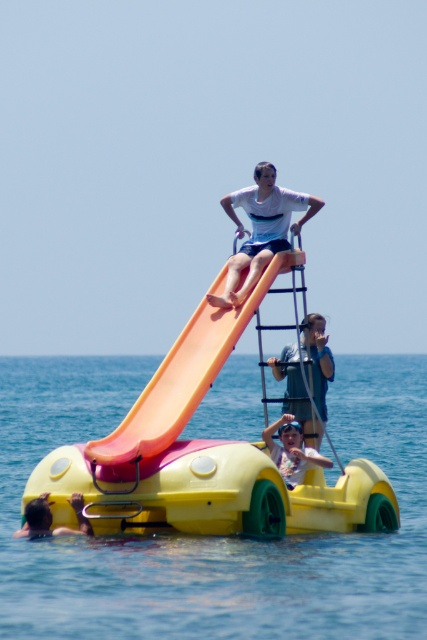
Question: Does transparent plastic water at center appear over blue denim shorts at center?

Choices:
 (A) no
 (B) yes

Answer: (B)

Question: Is transparent plastic water at center to the right of white matte shirt at upper center from the viewer's perspective?

Choices:
 (A) no
 (B) yes

Answer: (A)

Question: Which object is positioned farthest from the yellow matte pedal boat at upper center?

Choices:
 (A) transparent plastic water at center
 (B) dark brown hair at lower left
 (C) matte pink swimsuit at center

Answer: (A)

Question: Is transparent plastic water at center below white matte shirt at upper center?

Choices:
 (A) no
 (B) yes

Answer: (B)

Question: Which is nearer to the white matte shirt at upper center?

Choices:
 (A) matte pink swimsuit at center
 (B) dark brown hair at lower left
 (C) transparent plastic water at center

Answer: (A)

Question: Which of the following is the farthest from the observer?

Choices:
 (A) yellow matte pedal boat at upper center
 (B) orange matte slide at upper center
 (C) dark brown hair at lower left
 (D) transparent plastic water at center

Answer: (C)